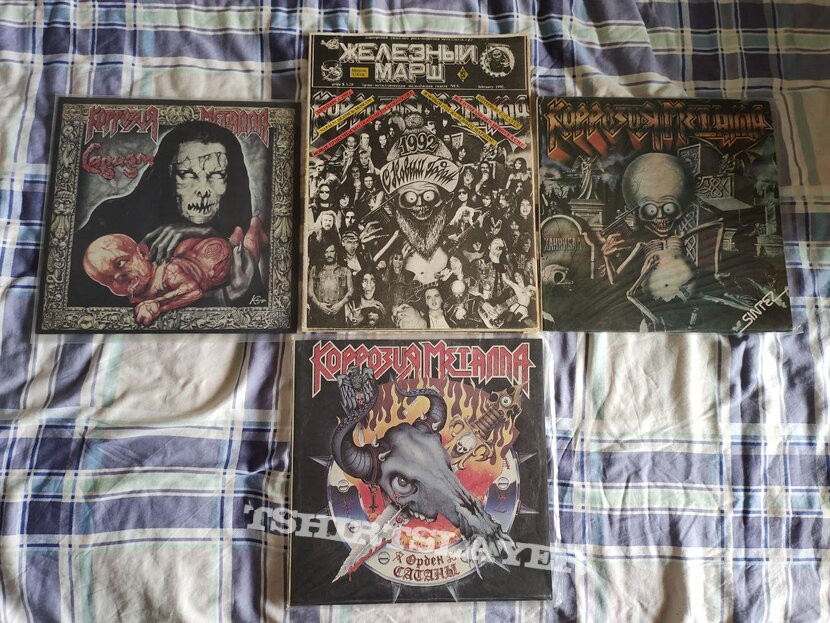
Locate an element on the screen. The image size is (830, 623). book is located at coordinates (486, 229).